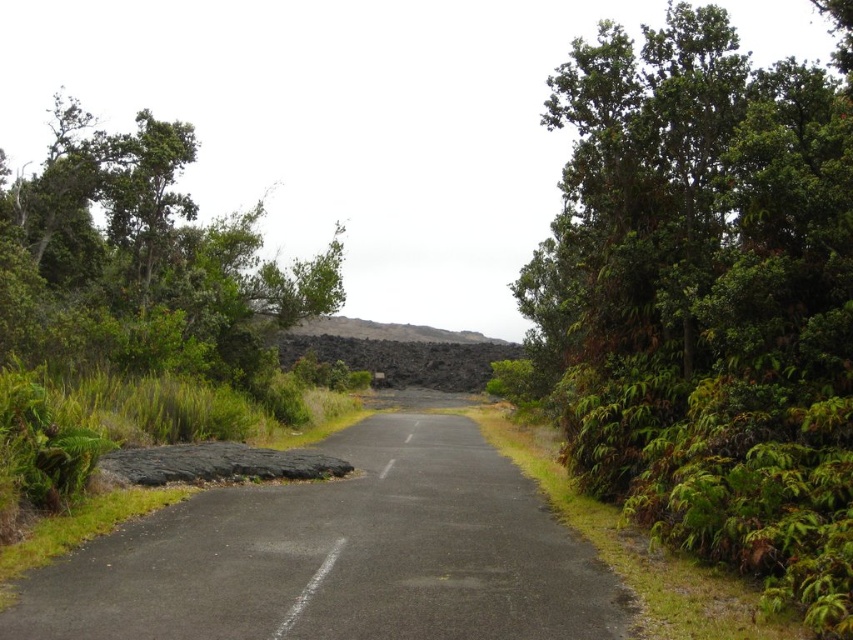
What do you see at coordinates (708, 298) in the screenshot? This screenshot has height=640, width=853. I see `green leafy tree at right` at bounding box center [708, 298].

Does green leafy tree at right come in front of green leafy tree at left?

Yes, it is.

Which is behind, point (851, 518) or point (84, 198)?

The point (84, 198) is behind.

At what (x,y) coordinates should I click in order to perform the action: click on green leafy tree at right. Please return your answer as a coordinate pair (x, y). Looking at the image, I should click on pyautogui.click(x=708, y=298).